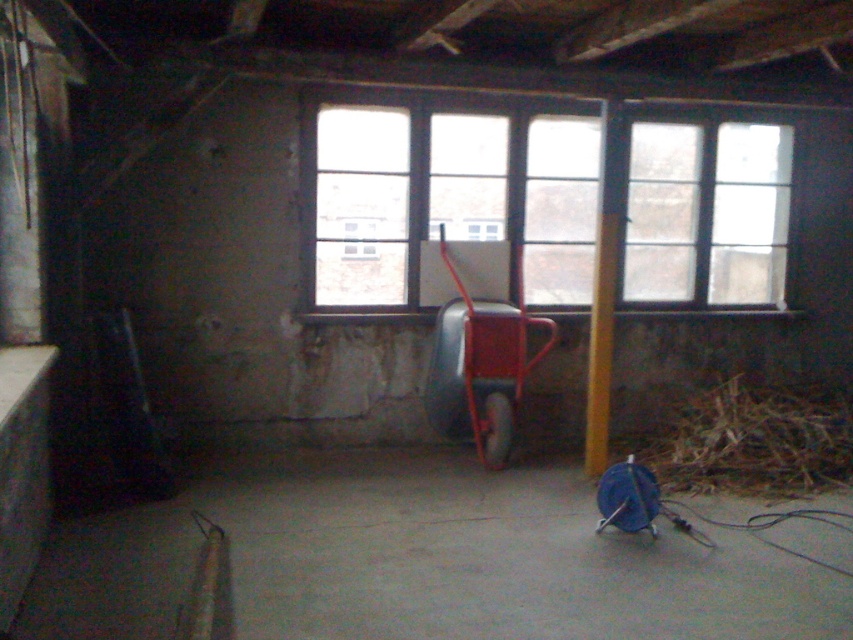
You are a contractor working in this room and need to move the blue plastic spool at center to the other side of the clear glass window at center. Based on their positions, which object would you have to move first?

The blue plastic spool at center is closer to the viewer than the clear glass window at center, so you would need to move the blue plastic spool at center first to access the area behind it before moving the clear glass window at center.

You are standing in the room and want to place a small potted plant on the floor. The potted plant requires a spot that is not occupied by the brown dry hay at lower right. Where should you place it?

The brown dry hay at lower right is located at point (753, 442), so you can place the potted plant anywhere else on the floor except that location.